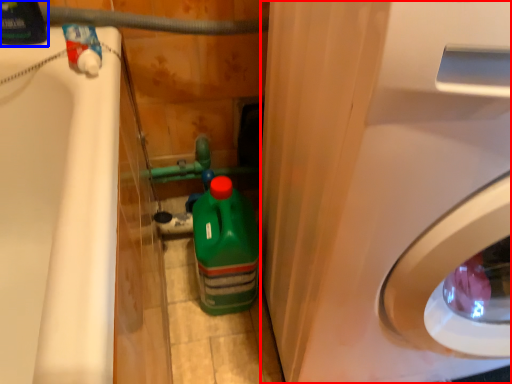
Question: Among these objects, which one is nearest to the camera, washing machine (highlighted by a red box) or cleaning product (highlighted by a blue box)?

Choices:
 (A) washing machine
 (B) cleaning product

Answer: (A)